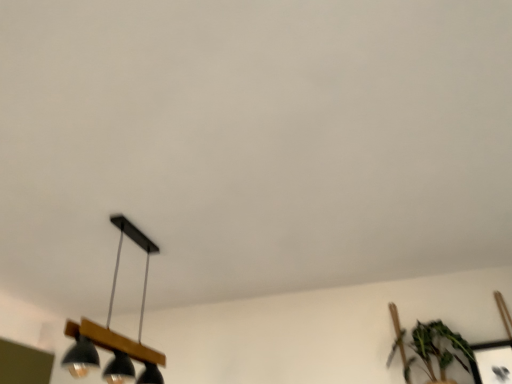
Question: From the image's perspective, is green leafy plant at lower right on top of black matte/wooden lamp at lower left?

Choices:
 (A) yes
 (B) no

Answer: (B)

Question: Is black matte/wooden lamp at lower left at the back of green leafy plant at lower right?

Choices:
 (A) yes
 (B) no

Answer: (B)

Question: Does green leafy plant at lower right touch black matte/wooden lamp at lower left?

Choices:
 (A) no
 (B) yes

Answer: (A)

Question: From a real-world perspective, is green leafy plant at lower right positioned over black matte/wooden lamp at lower left based on gravity?

Choices:
 (A) no
 (B) yes

Answer: (A)

Question: Is there a large distance between green leafy plant at lower right and black matte/wooden lamp at lower left?

Choices:
 (A) no
 (B) yes

Answer: (B)

Question: Can you confirm if green leafy plant at lower right is positioned to the left of black matte/wooden lamp at lower left?

Choices:
 (A) no
 (B) yes

Answer: (A)

Question: Could you tell me if green leafy plant at lower right is turned towards metallic silver picture frame at lower right?

Choices:
 (A) no
 (B) yes

Answer: (A)

Question: Can you confirm if green leafy plant at lower right is thinner than metallic silver picture frame at lower right?

Choices:
 (A) no
 (B) yes

Answer: (A)

Question: Considering the relative positions of green leafy plant at lower right and metallic silver picture frame at lower right in the image provided, is green leafy plant at lower right behind metallic silver picture frame at lower right?

Choices:
 (A) yes
 (B) no

Answer: (B)

Question: Does green leafy plant at lower right appear on the left side of metallic silver picture frame at lower right?

Choices:
 (A) yes
 (B) no

Answer: (A)

Question: Is green leafy plant at lower right outside metallic silver picture frame at lower right?

Choices:
 (A) no
 (B) yes

Answer: (B)

Question: Is green leafy plant at lower right placed right next to metallic silver picture frame at lower right?

Choices:
 (A) yes
 (B) no

Answer: (B)

Question: Does black matte/wooden lamp at lower left have a lesser width compared to metallic silver picture frame at lower right?

Choices:
 (A) yes
 (B) no

Answer: (B)